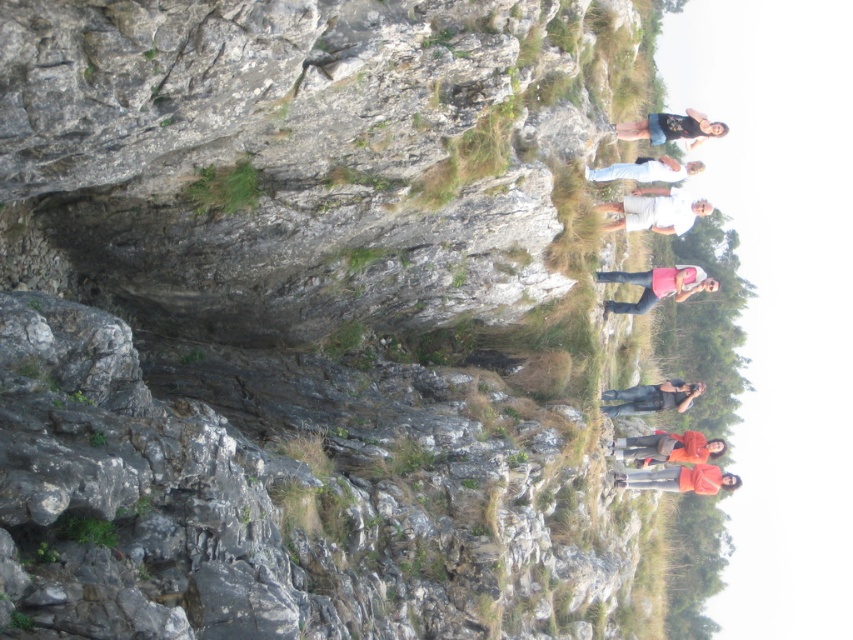
Question: Which object appears closest to the camera in this image?

Choices:
 (A) orange cotton shirt at lower right
 (B) matte orange shirt at lower right
 (C) white cotton shirt at upper center

Answer: (C)

Question: Can you confirm if denim shorts at upper right is bigger than denim jeans at center?

Choices:
 (A) yes
 (B) no

Answer: (A)

Question: Which point appears farthest from the camera in this image?

Choices:
 (A) (693, 433)
 (B) (613, 225)
 (C) (677, 484)
 (D) (648, 164)

Answer: (A)

Question: Does pink fabric at center appear on the left side of denim jeans at center?

Choices:
 (A) no
 (B) yes

Answer: (A)

Question: Is orange cotton shirt at lower right bigger than denim jeans at center?

Choices:
 (A) yes
 (B) no

Answer: (B)

Question: Among these objects, which one is nearest to the camera?

Choices:
 (A) matte orange shirt at lower right
 (B) white cotton shirt at upper center
 (C) orange cotton shirt at lower right
 (D) denim jeans at center

Answer: (B)